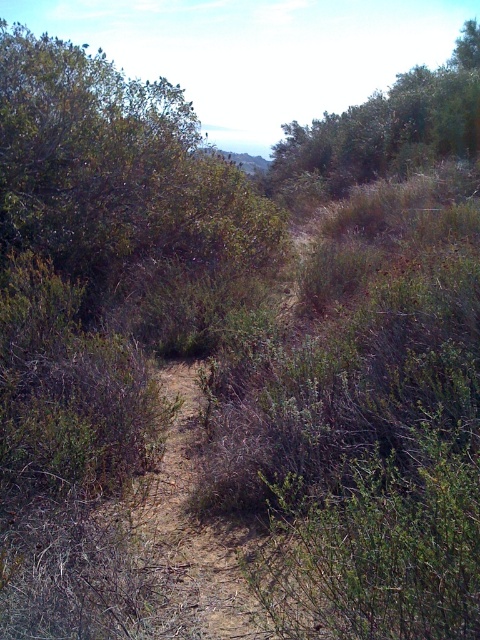
You are standing at the starting point of the dirt path and want to reach a landmark located at coordinates point 0.275, 0.244. Is the green leafy bush at center located at those coordinates?

Yes, the green leafy bush at center is located at point 0.244, so it is at the desired coordinates.

You are a hiker carrying a 10 meter long rope. You want to tie the rope between the green leafy bush at center and the green leafy tree at upper right. Is the rope long enough to stretch between them?

The distance between the green leafy bush at center and the green leafy tree at upper right is 10.45 meters. Since the rope is only 10 meters long, it is not long enough to stretch between them.